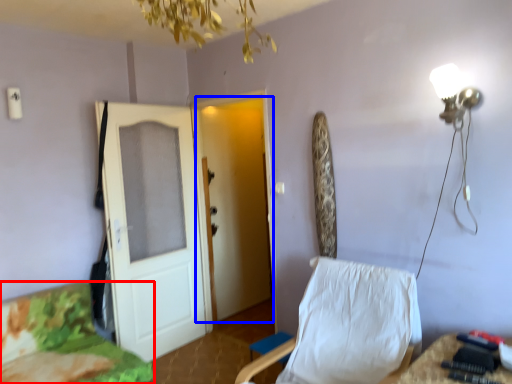
Question: Which object is closer to the camera taking this photo, furniture (highlighted by a red box) or door (highlighted by a blue box)?

Choices:
 (A) furniture
 (B) door

Answer: (A)